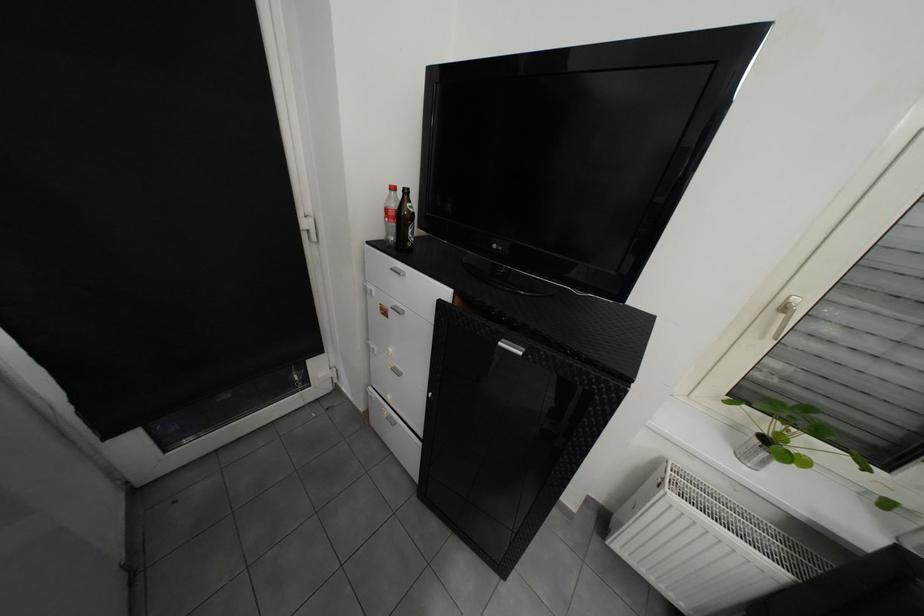
Where is `silver window handle`? The height and width of the screenshot is (616, 924). silver window handle is located at coordinates (784, 318).